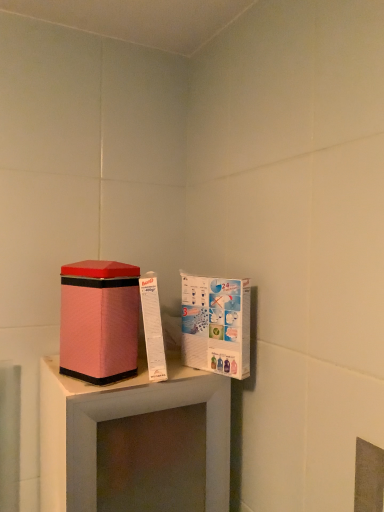
Question: Can we say pink fabric/textured box at left lies outside white cardboard box at upper right?

Choices:
 (A) no
 (B) yes

Answer: (B)

Question: Is the surface of pink fabric/textured box at left in direct contact with white cardboard box at upper right?

Choices:
 (A) no
 (B) yes

Answer: (A)

Question: Does pink fabric/textured box at left appear on the left side of white cardboard box at upper right?

Choices:
 (A) yes
 (B) no

Answer: (A)

Question: From the image's perspective, would you say pink fabric/textured box at left is positioned over white cardboard box at upper right?

Choices:
 (A) no
 (B) yes

Answer: (B)

Question: Would you consider pink fabric/textured box at left to be distant from white cardboard box at upper right?

Choices:
 (A) yes
 (B) no

Answer: (B)

Question: From a real-world perspective, is pink fabric/textured box at left positioned over white cardboard box at upper right based on gravity?

Choices:
 (A) no
 (B) yes

Answer: (B)

Question: From a real-world perspective, is white cardboard box at upper right on pink fabric/textured box at left?

Choices:
 (A) no
 (B) yes

Answer: (A)

Question: From the image's perspective, is white cardboard box at upper right below pink fabric/textured box at left?

Choices:
 (A) yes
 (B) no

Answer: (A)

Question: Is white cardboard box at upper right facing away from pink fabric/textured box at left?

Choices:
 (A) no
 (B) yes

Answer: (A)

Question: Is white cardboard box at upper right at the right side of pink fabric/textured box at left?

Choices:
 (A) yes
 (B) no

Answer: (A)

Question: Can you confirm if white cardboard box at upper right is positioned to the left of pink fabric/textured box at left?

Choices:
 (A) yes
 (B) no

Answer: (B)

Question: Does white cardboard box at upper right have a lesser height compared to pink fabric/textured box at left?

Choices:
 (A) no
 (B) yes

Answer: (A)

Question: Is white cardboard box at upper right bigger or smaller than pink fabric/textured box at left?

Choices:
 (A) big
 (B) small

Answer: (B)